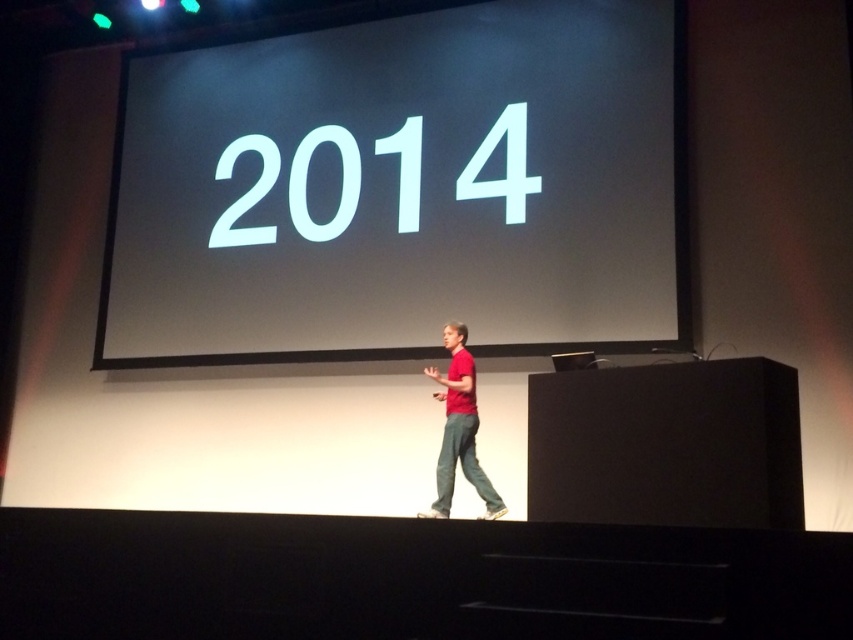
Is white glossy projection screen at upper center taller than red matte shirt at center?

Indeed, white glossy projection screen at upper center has a greater height compared to red matte shirt at center.

Looking at this image, is white glossy projection screen at upper center below red matte shirt at center?

Incorrect, white glossy projection screen at upper center is not positioned below red matte shirt at center.

Between point (427, 150) and point (454, 392), which one is positioned in front?

Point (454, 392)

You are a GUI agent. You are given a task and a screenshot of the screen. Output one action in this format:
    pyautogui.click(x=<x>, y=<y>)
    Task: Click on the white glossy projection screen at upper center
    This screenshot has width=853, height=640.
    Given the screenshot: What is the action you would take?
    pyautogui.click(x=402, y=188)